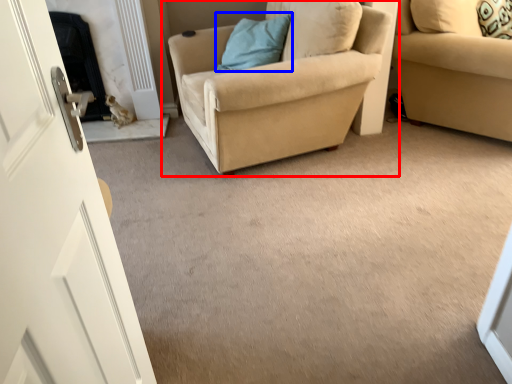
Question: Which object is closer to the camera taking this photo, chair (highlighted by a red box) or pillow (highlighted by a blue box)?

Choices:
 (A) chair
 (B) pillow

Answer: (A)